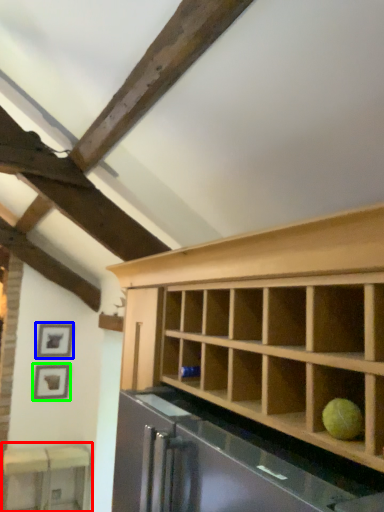
Question: Considering the real-world distances, which object is closest to table (highlighted by a red box)? picture frame (highlighted by a blue box) or picture frame (highlighted by a green box).

Choices:
 (A) picture frame
 (B) picture frame

Answer: (B)